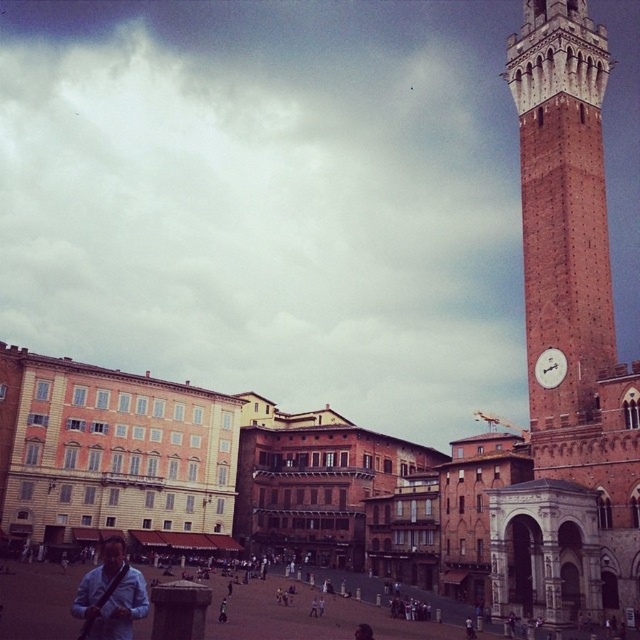
You are an architect visiting the square and want to take a photo of the white glossy clock at upper right while standing near the matte brick town square at center. Which direction should you face to ensure the clock is visible in your photo?

The matte brick town square at center is located below the white glossy clock at upper right, so you should face upward to ensure the clock is visible in your photo.

You are an artist setting up an easel in the square and want to paint both the matte brick town square at center and the blue fabric bag at lower left. Since you have limited canvas space, which object should you paint first to ensure it fits on your canvas?

The matte brick town square at center is wider than the blue fabric bag at lower left, so you should paint the matte brick town square at center first to ensure it occupies the necessary space on the canvas.

You are an architect designing a scale model of this historic square. You need to place both the matte brick town square at center and the white glossy clock at upper right on your model. Given that the clock must be placed proportionally to its actual size, which object should occupy more horizontal space on your model?

The matte brick town square at center should occupy more horizontal space on the model since its width is larger than the white glossy clock at upper right.